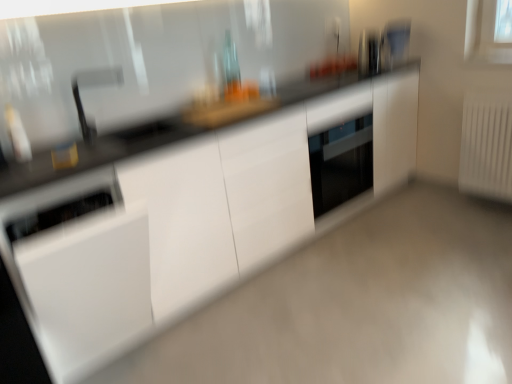
Question: Can white glossy dishwasher at lower left, which appears as the 3th appliance when viewed from the back, be found inside white glossy cabinet at center?

Choices:
 (A) no
 (B) yes

Answer: (B)

Question: Is white glossy cabinet at center at the right side of white glossy dishwasher at lower left, placed as the 1th appliance when sorted from front to back?

Choices:
 (A) yes
 (B) no

Answer: (A)

Question: Considering the relative sizes of white glossy cabinet at center and white glossy dishwasher at lower left, the first appliance when ordered from bottom to top, in the image provided, is white glossy cabinet at center thinner than white glossy dishwasher at lower left, the first appliance when ordered from bottom to top,?

Choices:
 (A) no
 (B) yes

Answer: (B)

Question: Could you tell me if white glossy cabinet at center is facing white glossy dishwasher at lower left, placed as the 1th appliance when sorted from front to back?

Choices:
 (A) no
 (B) yes

Answer: (B)

Question: From a real-world perspective, is white glossy cabinet at center beneath white glossy dishwasher at lower left, which is counted as the third appliance, starting from the top?

Choices:
 (A) no
 (B) yes

Answer: (B)

Question: Do you think satin nickel faucet at upper left is within white glossy dishwasher at lower left, which is counted as the third appliance, starting from the right, or outside of it?

Choices:
 (A) inside
 (B) outside

Answer: (B)

Question: Relative to white glossy dishwasher at lower left, marked as the first appliance in a left-to-right arrangement, is satin nickel faucet at upper left in front or behind?

Choices:
 (A) behind
 (B) front

Answer: (A)

Question: Based on their positions, is satin nickel faucet at upper left located to the left or right of white glossy dishwasher at lower left, the first appliance when ordered from bottom to top?

Choices:
 (A) left
 (B) right

Answer: (B)

Question: From the image's perspective, is satin nickel faucet at upper left above or below white glossy dishwasher at lower left, placed as the 1th appliance when sorted from front to back?

Choices:
 (A) above
 (B) below

Answer: (A)

Question: Considering the positions of white glossy cabinet at center and white glossy cabinet at center in the image, is white glossy cabinet at center taller or shorter than white glossy cabinet at center?

Choices:
 (A) tall
 (B) short

Answer: (B)

Question: Is point (232, 322) closer or farther from the camera than point (93, 311)?

Choices:
 (A) closer
 (B) farther

Answer: (B)

Question: From the image's perspective, relative to white glossy cabinet at center, is white glossy cabinet at center above or below?

Choices:
 (A) below
 (B) above

Answer: (A)

Question: Is white glossy cabinet at center inside or outside of white glossy cabinet at center?

Choices:
 (A) inside
 (B) outside

Answer: (B)

Question: Is white glossy cabinet at center taller or shorter than satin silver toaster at upper right, which is the third appliance from front to back?

Choices:
 (A) tall
 (B) short

Answer: (A)

Question: Is white glossy cabinet at center situated inside satin silver toaster at upper right, positioned as the first appliance in right-to-left order, or outside?

Choices:
 (A) inside
 (B) outside

Answer: (B)